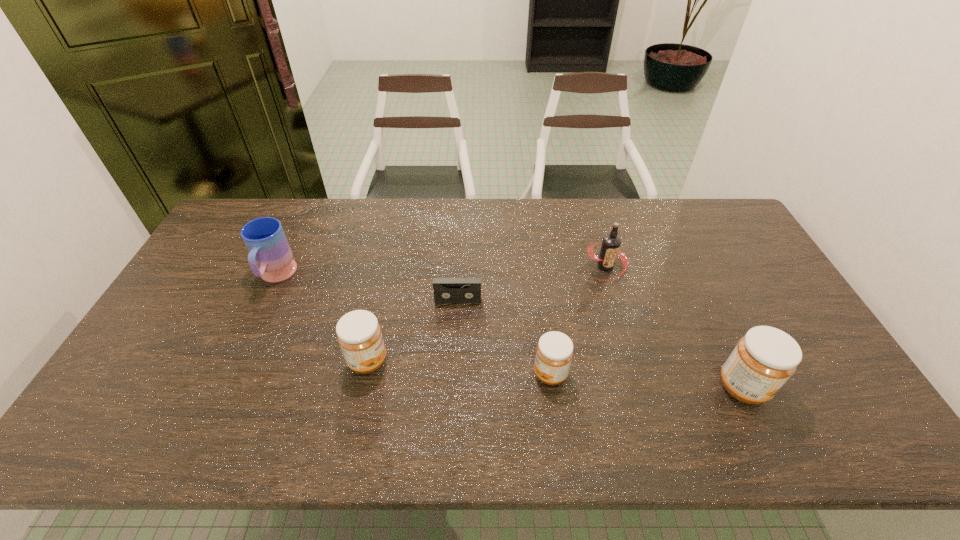
At what (x,y) coordinates should I click in order to perform the action: click on vacant space located on the front label of the second jam from left to right. Please return your answer as a coordinate pair (x, y). Looking at the image, I should click on (478, 374).

Locate an element on the screen. The height and width of the screenshot is (540, 960). free space located on the front label of the second jam from left to right is located at coordinates (393, 374).

The width and height of the screenshot is (960, 540). Find the location of `vacant area located 0.290m on the front label of the second jam from left to right`. vacant area located 0.290m on the front label of the second jam from left to right is located at coordinates (420, 374).

This screenshot has height=540, width=960. What are the coordinates of `free point located 0.140m on the front label of the rightmost object` in the screenshot? It's located at (823, 387).

The width and height of the screenshot is (960, 540). In order to click on free space located 0.180m on the front-facing side of the shortest object in this screenshot , I will do `click(455, 354)`.

In order to click on free space located 0.210m on the side of the leftmost object with the handle in this screenshot , I will do `click(240, 355)`.

Locate an element on the screen. free region located 0.220m on the label of the root beer is located at coordinates (627, 341).

What are the coordinates of `free spot at the far edge of the desktop` in the screenshot? It's located at (663, 235).

This screenshot has height=540, width=960. I want to click on free region at the near edge, so click(x=372, y=387).

Where is `free space at the near left corner of the desktop`? This screenshot has height=540, width=960. free space at the near left corner of the desktop is located at coordinates (142, 394).